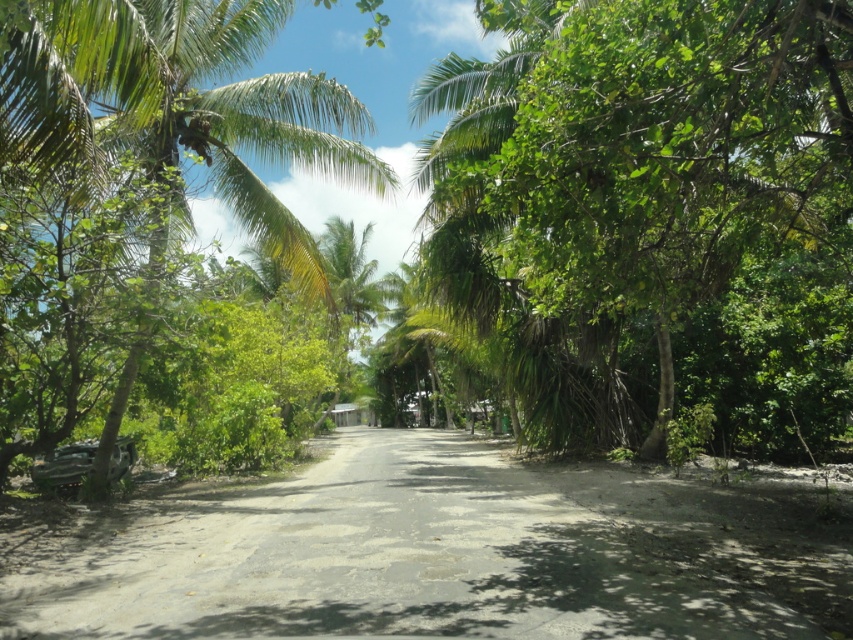
You are a gardener planning to plant a new palm tree between the green leafy palm tree at center and the green leafy palm tree at left. Based on their widths, which existing palm tree should you consider as the reference for spacing to ensure adequate space for the new tree?

The green leafy palm tree at center might be wider than the green leafy palm tree at left, so you should use the center palm tree as the reference for spacing to ensure enough space for the new tree.

Based on the photo, you are a hiker walking along the dirt road at center. You notice a green leafy palm tree at center nearby. Which object appears larger in the scene?

The green leafy palm tree at center appears larger than the dirt road at center in the scene.

From the picture: You are standing at the start of the dirt road at center and want to walk towards the green leafy palm tree at center. Which direction should you turn to reach it?

Since the green leafy palm tree at center is to the right of the dirt road at center, you should turn to your right to reach it.